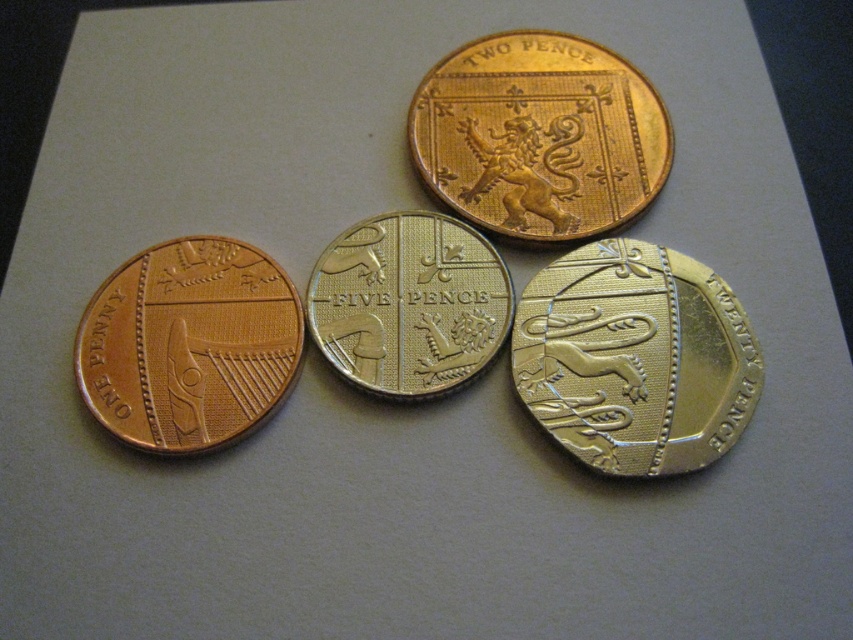
Question: Does gold metallic twenty pence at center have a lesser width compared to silver/golden metallic five pence at center?

Choices:
 (A) yes
 (B) no

Answer: (B)

Question: Is gold metallic twenty pence at center above silver/golden metallic five pence at center?

Choices:
 (A) yes
 (B) no

Answer: (B)

Question: Is gold metallic twenty pence at center smaller than gold shiny two pence at upper center?

Choices:
 (A) no
 (B) yes

Answer: (A)

Question: Which object is closer to the camera taking this photo?

Choices:
 (A) gold metallic twenty pence at center
 (B) gold shiny two pence at upper center
 (C) silver/golden metallic five pence at center
 (D) matte copper coin at lower left

Answer: (A)

Question: Considering the real-world distances, which object is farthest from the gold metallic twenty pence at center?

Choices:
 (A) matte copper coin at lower left
 (B) gold shiny two pence at upper center

Answer: (A)

Question: Which of the following is the farthest from the observer?

Choices:
 (A) (415, 316)
 (B) (202, 264)

Answer: (B)